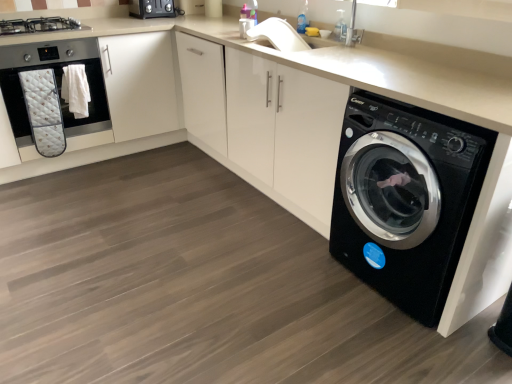
Identify the location of free location above black glossy washing machine at lower right (from a real-world perspective). The width and height of the screenshot is (512, 384). (450, 85).